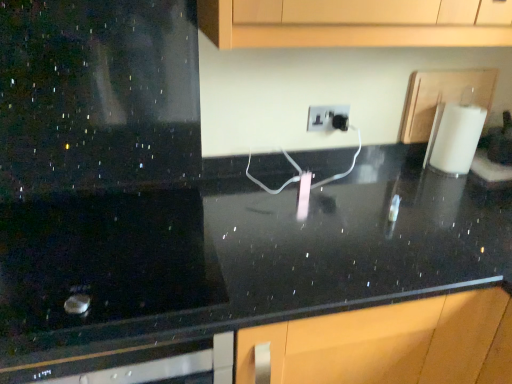
Image resolution: width=512 pixels, height=384 pixels. What are the coordinates of `free space in front of white matte paper towel at right` in the screenshot? It's located at (460, 188).